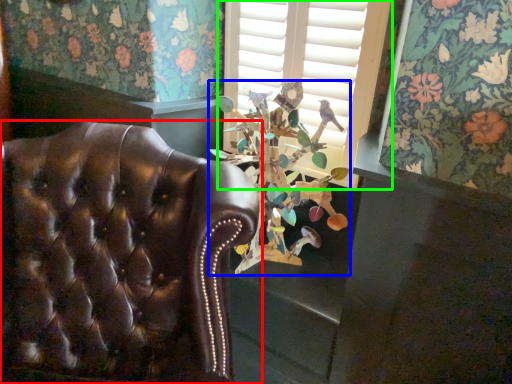
Question: Which is nearer to the chair (highlighted by a red box)? floral arrangement (highlighted by a blue box) or window (highlighted by a green box).

Choices:
 (A) floral arrangement
 (B) window

Answer: (A)